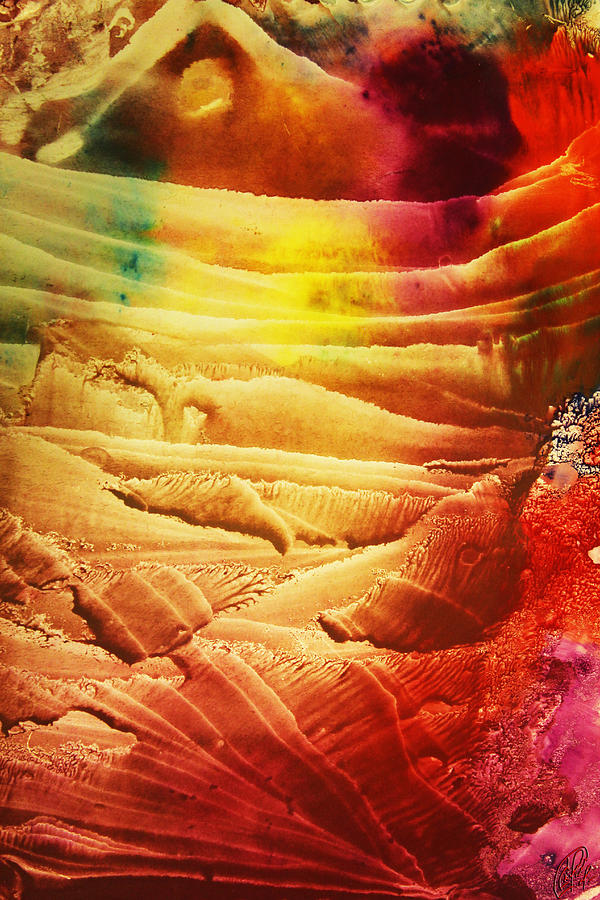
The width and height of the screenshot is (600, 900). I want to click on paint, so point(336,750).